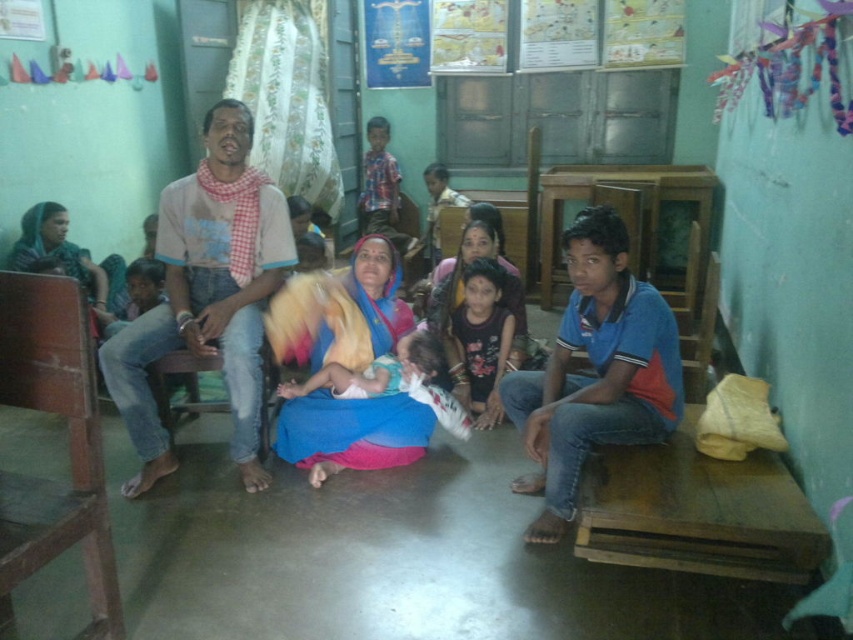
You are a photographer who wants to capture a photo of the light brown cotton shirt at left and the dark blue fabric dress at center. Which object is located to the left of the other?

The light brown cotton shirt at left is positioned on the left side of dark blue fabric dress at center.